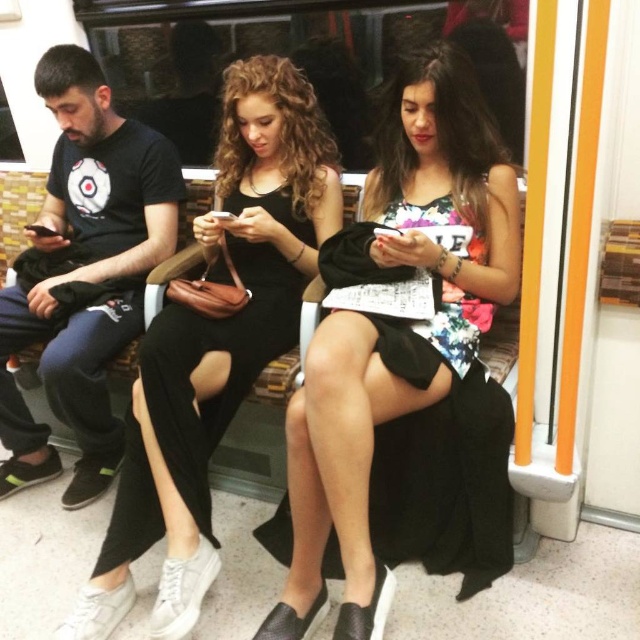
Which is more to the left, black matte t-shirt at left or black matte dress at center?

black matte t-shirt at left

Locate an element on the screen. black matte t-shirt at left is located at coordinates (83, 275).

Can you confirm if floral printed dress at center is positioned to the right of black matte t-shirt at left?

Correct, you'll find floral printed dress at center to the right of black matte t-shirt at left.

Measure the distance from floral printed dress at center to black matte t-shirt at left.

floral printed dress at center is 35.44 inches away from black matte t-shirt at left.

Where is `floral printed dress at center`? This screenshot has width=640, height=640. floral printed dress at center is located at coordinates (396, 330).

Image resolution: width=640 pixels, height=640 pixels. I want to click on floral printed dress at center, so click(x=396, y=330).

Which is more to the left, floral printed dress at center or black matte dress at center?

black matte dress at center

Can you confirm if floral printed dress at center is thinner than black matte dress at center?

Incorrect, floral printed dress at center's width is not less than black matte dress at center's.

Who is more forward, [352,323] or [188,340]?

Positioned in front is point [352,323].

Identify the location of floral printed dress at center. (396, 330).